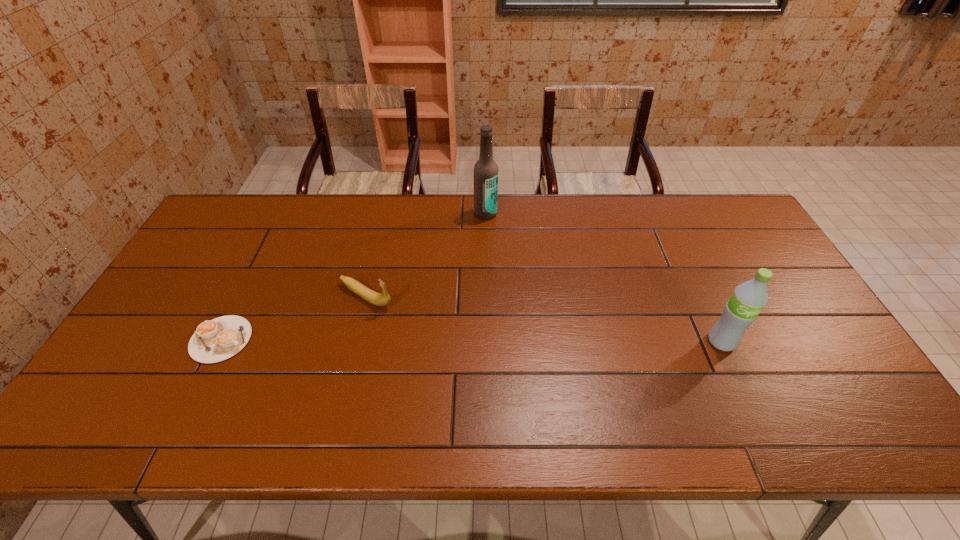
The image size is (960, 540). In order to click on blank area in the image that satisfies the following two spatial constraints: 1. on the back side of the shortest object; 2. on the left side of the farthest object in this screenshot , I will do click(284, 213).

At what (x,y) coordinates should I click in order to perform the action: click on vacant area that satisfies the following two spatial constraints: 1. on the front side of the water bottle; 2. on the left side of the beer bottle. Please return your answer as a coordinate pair (x, y). Looking at the image, I should click on (488, 341).